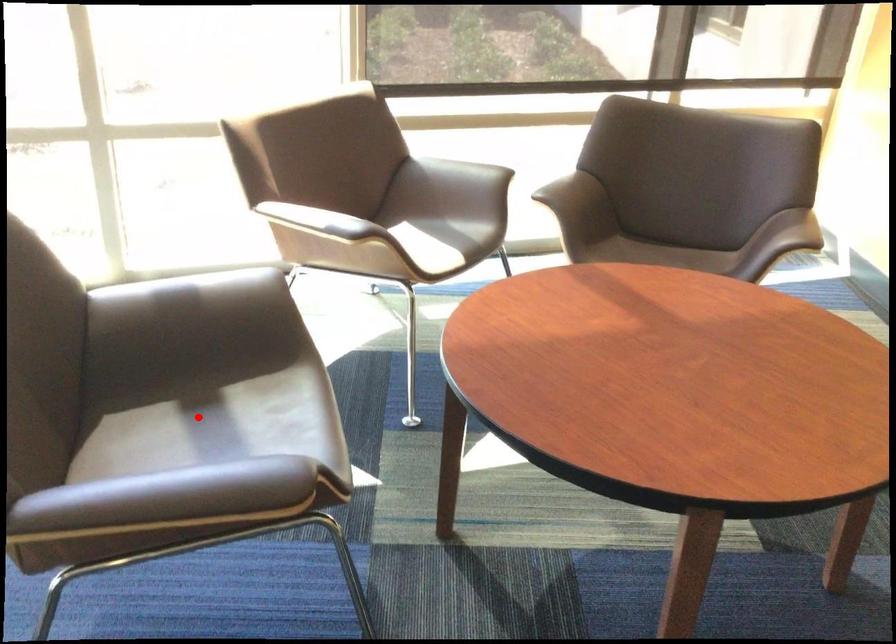
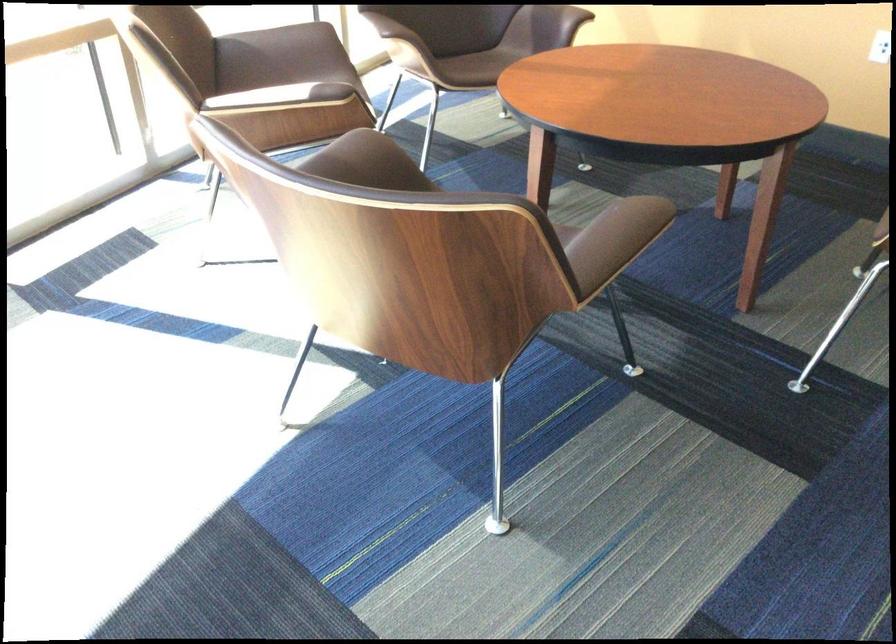
Question: I am providing you with two images of the same scene from different viewpoints. A red point is marked on the first image. Can you still see the location of the red point in image 2?

Choices:
 (A) Yes
 (B) No

Answer: (B)